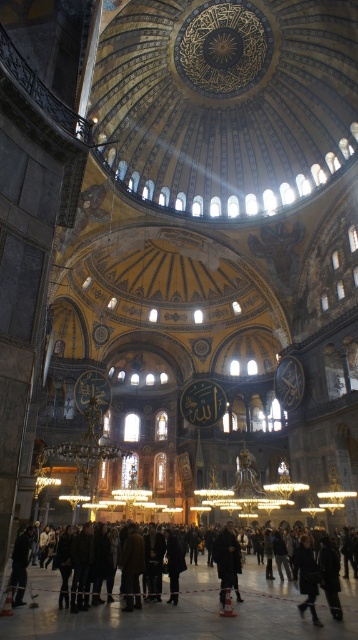
Which is more to the right, brown leather coat at center or dark wool coat at center?

dark wool coat at center is more to the right.

Which of these two, brown leather coat at center or dark wool coat at center, stands shorter?

brown leather coat at center

Which is behind, point (127, 541) or point (242, 600)?

The point (242, 600) is more distant.

Locate an element on the screen. The height and width of the screenshot is (640, 358). brown leather coat at center is located at coordinates (132, 568).

Which is behind, point (277, 579) or point (21, 552)?

The point (277, 579) is more distant.

Who is taller, dark brown coat at lower center or dark brown leather jacket at lower left?

dark brown coat at lower center is taller.

Between point (50, 620) and point (16, 557), which one is positioned in front?

Point (50, 620)

I want to click on dark brown coat at lower center, so click(185, 611).

Which of these two, dark wool coat at center or dark brown leather jacket at lower left, stands shorter?

dark brown leather jacket at lower left

What do you see at coordinates (226, 561) in the screenshot? This screenshot has width=358, height=640. I see `dark wool coat at center` at bounding box center [226, 561].

Where is `dark wool coat at center`? dark wool coat at center is located at coordinates (226, 561).